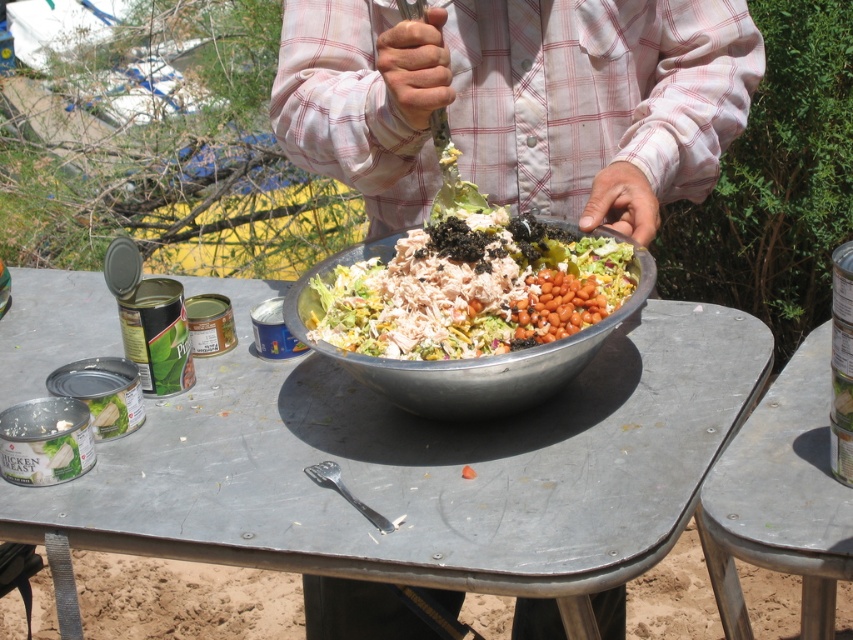
You are a chef preparing a salad and need to place a large bowl on the closest table. Which table should you choose between the metallic gray table at center and the metallic gray picnic table at lower right?

The metallic gray table at center is closer to the metallic gray picnic table at lower right by 13.72 inches, so you should choose the metallic gray table at center as it is closer.

You are standing at the origin point of the image. Where is the metallic gray table at center located in terms of coordinates?

The metallic gray table at center is located at coordinates point (419, 465).

You are standing at the table where the salad is being prepared. There are two points marked on the table surface. One is at coordinate point (247, 456) and the other at point (643, 288). If you want to reach the point that is closer to you, which coordinate should you aim for?

The point at (247, 456) is in front of point (643, 288), so you should aim for point (247, 456) as it is closer to you.